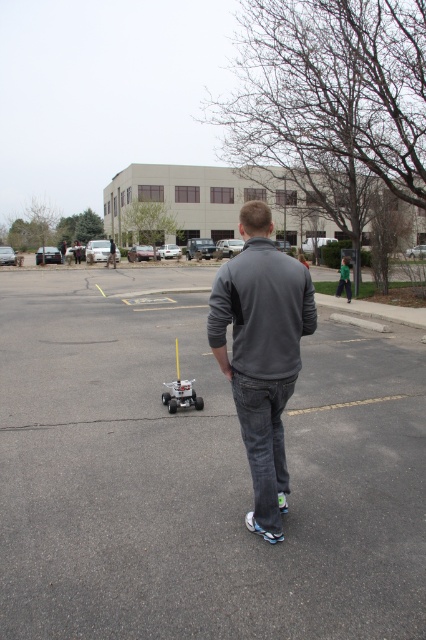
Question: Considering the relative positions of gray fleece jacket at center and white plastic toy at center in the image provided, where is gray fleece jacket at center located with respect to white plastic toy at center?

Choices:
 (A) right
 (B) left

Answer: (A)

Question: Which of the following is the farthest from the observer?

Choices:
 (A) white plastic toy at center
 (B) silver metallic toy car at center
 (C) gray fleece jacket at center
 (D) gray asphalt parking lot at center

Answer: (A)

Question: Does gray fleece jacket at center appear over white plastic toy at center?

Choices:
 (A) no
 (B) yes

Answer: (B)

Question: Estimate the real-world distances between objects in this image. Which object is closer to the silver metallic toy car at center?

Choices:
 (A) gray fleece jacket at center
 (B) gray asphalt parking lot at center

Answer: (B)

Question: Which of the following is the farthest from the observer?

Choices:
 (A) (250, 456)
 (B) (201, 401)
 (C) (69, 380)
 (D) (172, 400)

Answer: (C)

Question: From the image, what is the correct spatial relationship of gray asphalt parking lot at center in relation to white plastic toy at center?

Choices:
 (A) right
 (B) left

Answer: (A)